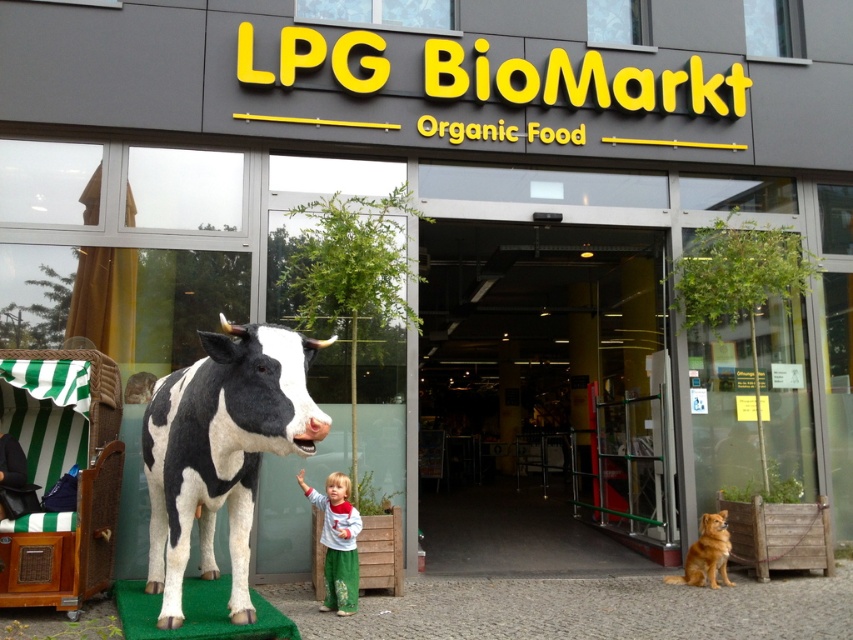
You are standing in front of the LPG BioMarkt store and want to take a photo of the cow statue and the child. The cow statue is at point (480,440) and the child is at point (341,540). Which point should you focus on first to ensure both are in focus?

You should focus on point (480,440) first because it is closer to the camera than point (341,540). This ensures both the cow statue and the child are in focus.

You are a delivery person with a package that needs to be placed between the black and white polka dot bull at center and the matte gray pants at lower center. The package is 40 inches long. Can you fit it between them?

The distance between the black and white polka dot bull at center and the matte gray pants at lower center is 39.28 inches. Since the package is 40 inches long, it cannot fit between them as the space is slightly smaller than the package.

You are a delivery person with a cart that is 1.2 meters wide. You need to enter the LPG BioMarkt store. Can your cart fit through the glass door at center if the black and white polka dot bull at center is standing in front of it?

The glass door at center is wider than the black and white polka dot bull at center. Since the bull is blocking the door, you would need to move it aside to allow the cart to pass through the wider door.